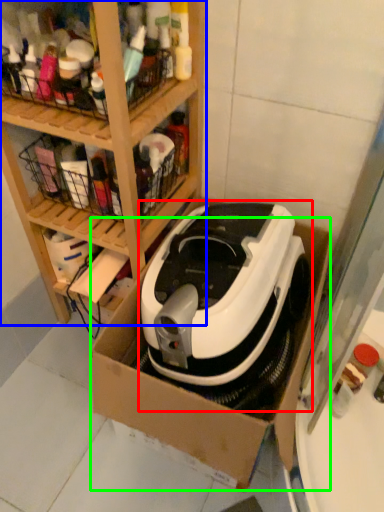
Question: Based on their relative distances, which object is nearer to home appliance (highlighted by a red box)? Choose from shelf (highlighted by a blue box) and cardboard box (highlighted by a green box).

Choices:
 (A) shelf
 (B) cardboard box

Answer: (B)